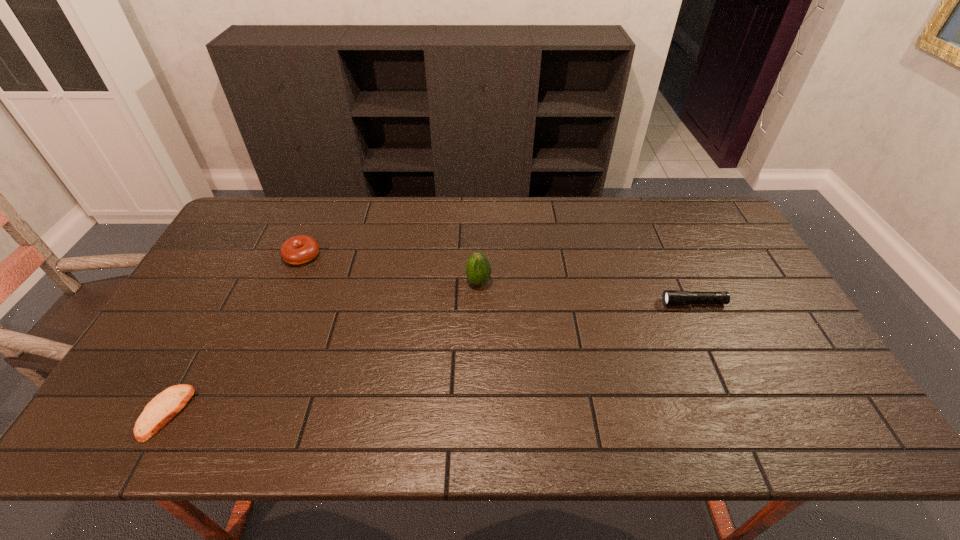
Where is `vacant point located between the shortest object and the farthest object`? This screenshot has width=960, height=540. vacant point located between the shortest object and the farthest object is located at coordinates (234, 334).

Where is `vacant space that is in between the second shortest object and the nearest object`? vacant space that is in between the second shortest object and the nearest object is located at coordinates (430, 358).

You are a GUI agent. You are given a task and a screenshot of the screen. Output one action in this format:
    pyautogui.click(x=<x>, y=<y>)
    Task: Click on the free space between the farthest object and the rightmost object
    This screenshot has height=540, width=960.
    Given the screenshot: What is the action you would take?
    pyautogui.click(x=497, y=279)

Identify which object is the second nearest to the pita bread. Please provide its 2D coordinates. Your answer should be formatted as a tuple, i.e. [(x, y)], where the tuple contains the x and y coordinates of a point satisfying the conditions above.

[(478, 269)]

Identify which object is the third closest to the tallest object. Please provide its 2D coordinates. Your answer should be formatted as a tuple, i.e. [(x, y)], where the tuple contains the x and y coordinates of a point satisfying the conditions above.

[(166, 405)]

Identify the location of vacant position in the image that satisfies the following two spatial constraints: 1. on the back side of the leftmost object; 2. on the right side of the doughnut. (252, 255).